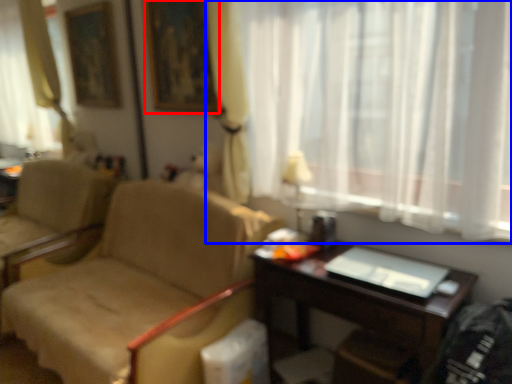
Question: Which object is closer to the camera taking this photo, picture frame (highlighted by a red box) or curtain (highlighted by a blue box)?

Choices:
 (A) picture frame
 (B) curtain

Answer: (B)